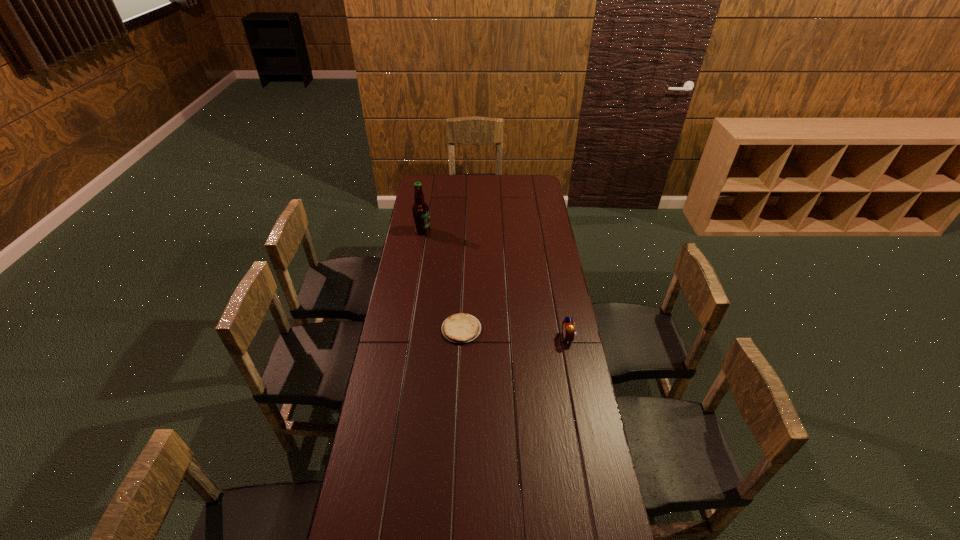
This screenshot has height=540, width=960. I want to click on vacant point located on the back of the second object from right to left, so click(463, 305).

Identify the location of object present at the left edge. (420, 210).

Where is `object situated at the right edge`? Image resolution: width=960 pixels, height=540 pixels. object situated at the right edge is located at coordinates (568, 328).

Where is `vacant region at the far edge of the desktop`? vacant region at the far edge of the desktop is located at coordinates (450, 179).

The height and width of the screenshot is (540, 960). In the image, there is a desktop. What are the coordinates of `vacant region at the left edge` in the screenshot? It's located at (436, 204).

Where is `free space at the right edge of the desktop`? The height and width of the screenshot is (540, 960). free space at the right edge of the desktop is located at coordinates (540, 231).

Where is `free area in between the beer bottle and the second shortest object`? This screenshot has width=960, height=540. free area in between the beer bottle and the second shortest object is located at coordinates (495, 285).

The width and height of the screenshot is (960, 540). I want to click on empty space that is in between the rightmost object and the second object from right to left, so click(x=515, y=334).

Where is `empty location between the shortest object and the alarm clock`? empty location between the shortest object and the alarm clock is located at coordinates (515, 334).

This screenshot has width=960, height=540. I want to click on vacant space that's between the alarm clock and the tortilla, so click(515, 334).